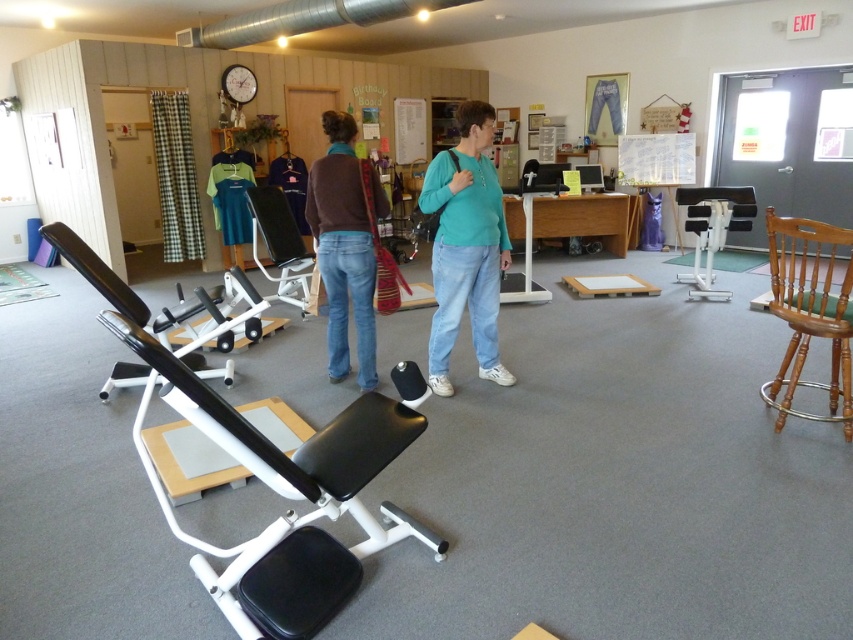
Question: Considering the relative positions of brown cotton sweater at center and white plastic chair at right in the image provided, where is brown cotton sweater at center located with respect to white plastic chair at right?

Choices:
 (A) above
 (B) below

Answer: (B)

Question: Which object is closer to the camera taking this photo?

Choices:
 (A) teal matte shirt at center
 (B) black plastic exercise bench at center

Answer: (A)

Question: Which is farther from the brown cotton sweater at center?

Choices:
 (A) white plastic chair at right
 (B) teal matte shirt at center
 (C) black matte bench at left
 (D) light brown wooden chair at right

Answer: (A)

Question: Which point appears farthest from the camera in this image?

Choices:
 (A) tap(431, 182)
 (B) tap(274, 195)

Answer: (B)

Question: From the image, what is the correct spatial relationship of teal matte shirt at center in relation to brown cotton sweater at center?

Choices:
 (A) above
 (B) below

Answer: (A)

Question: Does black matte bench at left have a lesser width compared to brown cotton sweater at center?

Choices:
 (A) no
 (B) yes

Answer: (A)